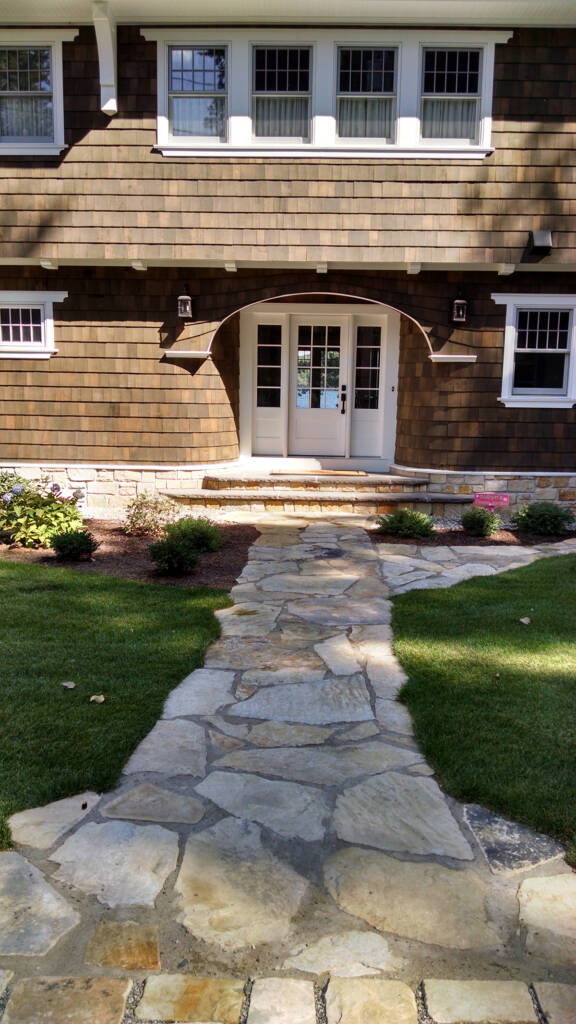
Identify the location of door lock. The image size is (576, 1024). (343, 384).